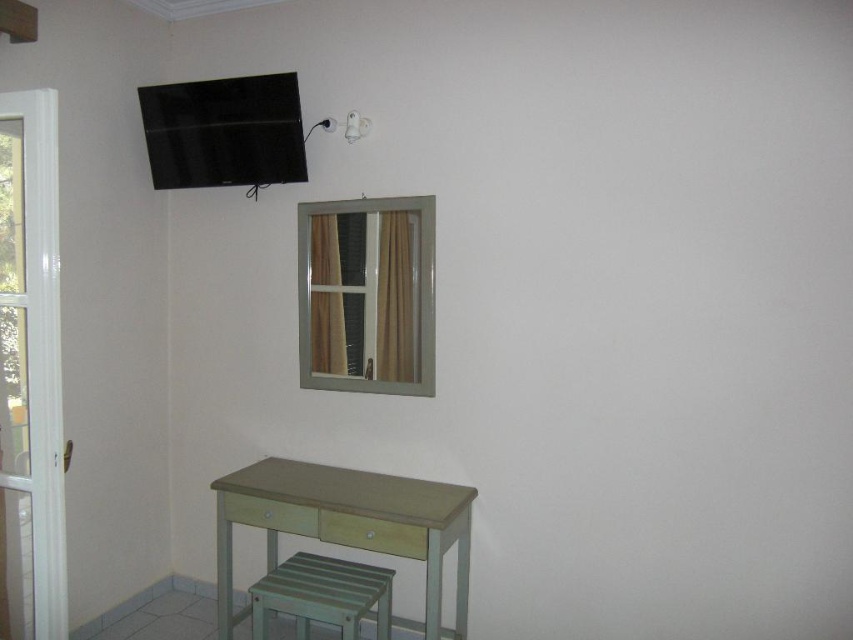
In the scene shown: You are arranging a small plant on the light green wooden table at lower left and want to place it so that it reflects in the metallic frame window at center. Can the entire plant fit within the reflection of the window?

The metallic frame window at center has a smaller size compared to the light green wooden table at lower left. Since the window is smaller, the reflection it captures might not encompass the entire plant if the plant is placed on the table. Therefore, the entire plant may not fit within the window reflection.

You are standing at the entrance of the room and want to place a new plant stand that is 7 feet wide between the entrance and the light green wooden table at lower left. Can you fit the plant stand in that space?

The distance of light green wooden table at lower left from camera is 7.47 feet. Since the plant stand is 7 feet wide, it will fit as there is enough space between the entrance and the light green wooden table at lower left.